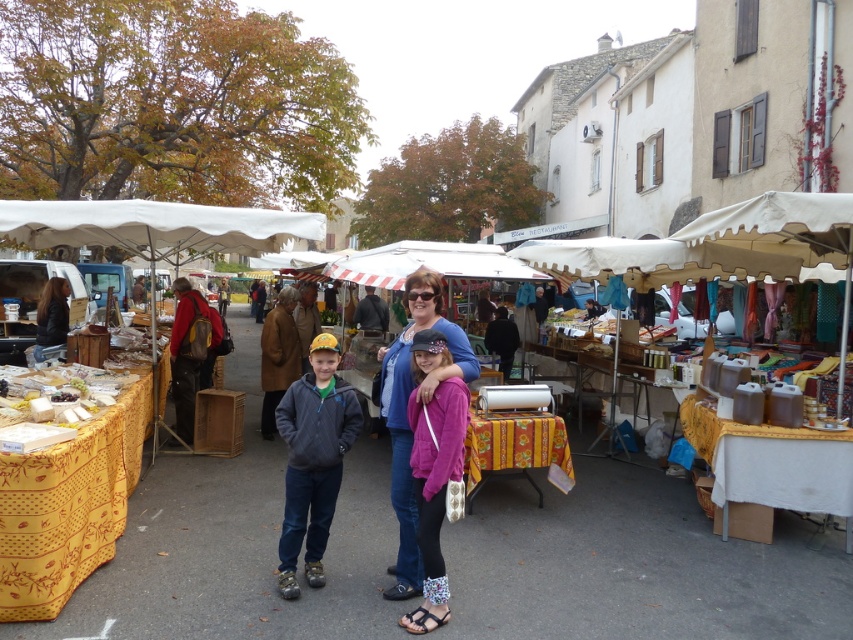
You are a photographer trying to capture a photo of the white fabric canopy at left and the dark brown leather jacket at left. Which object will appear taller in the photo?

The dark brown leather jacket at left will appear taller in the photo because it is taller than the white fabric canopy at left.

You are a photographer setting up a tripod to capture the market scene. You notice the matte blue sweater at center and the dark brown leather jacket at left. Which item should you adjust your camera angle to focus on first if you want to prioritize capturing the wider object?

The dark brown leather jacket at left is wider than the matte blue sweater at center, so you should focus on the dark brown leather jacket at left first to capture its wider size.